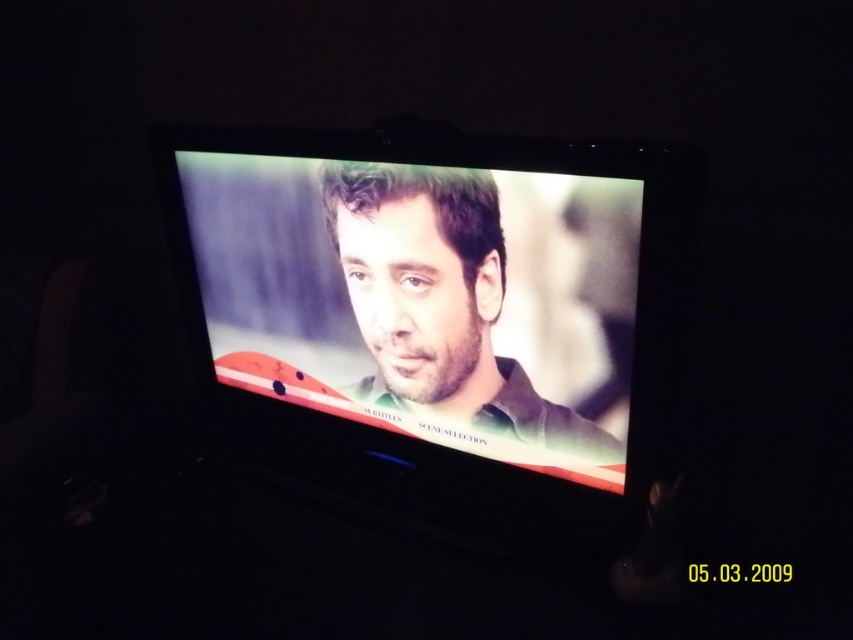
You are setting up a camera to film the matte black screen at center and the matte black face at center. To ensure both are in frame, where should you position the camera relative to the objects?

The matte black screen at center is to the left of the matte black face at center, so position the camera to the right side of both objects to capture them within the frame.

You are positioning a new TV mount in a room. The mount requires the TV to be placed exactly at the center point of the wall, which is at coordinate point 0.5, 0.5. The current TV, which is the matte black screen at center, is slightly off the center. Is the current TV positioned to the left or right of the desired center point?

The 2D location of the matte black screen at center is at point (438, 300). Since the x coordinate is 0.470 which is less than 0.5, the current TV is positioned to the left of the desired center point.

You are a photographer trying to capture a closeup of the matte black face at center and the matte green shirt at center in the TV screen. Which object is wider?

The matte black face at center is wider than the matte green shirt at center.